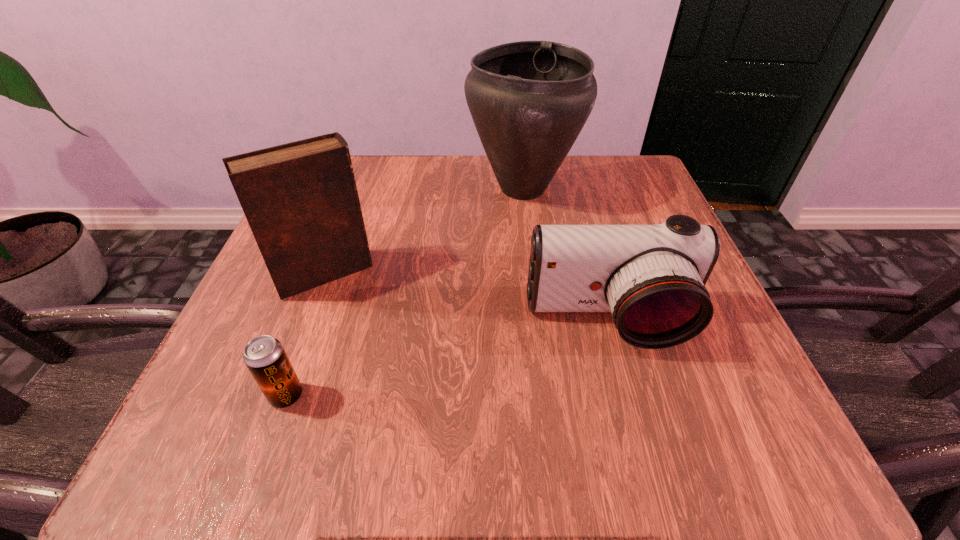
Find the location of a particular element. The width and height of the screenshot is (960, 540). free space at the near left corner is located at coordinates (173, 451).

Locate an element on the screen. vacant space at the near right corner of the desktop is located at coordinates (763, 441).

You are a GUI agent. You are given a task and a screenshot of the screen. Output one action in this format:
    pyautogui.click(x=<x>, y=<y>)
    Task: Click on the vacant point located between the nearest object and the farthest object
    The height and width of the screenshot is (540, 960).
    Given the screenshot: What is the action you would take?
    pyautogui.click(x=404, y=292)

You are a GUI agent. You are given a task and a screenshot of the screen. Output one action in this format:
    pyautogui.click(x=<x>, y=<y>)
    Task: Click on the vacant space that is in between the nearest object and the camcorder
    This screenshot has width=960, height=540.
    Given the screenshot: What is the action you would take?
    pyautogui.click(x=447, y=359)

I want to click on free space between the urn and the Bible, so click(x=423, y=231).

Find the location of a particular element. The height and width of the screenshot is (540, 960). free area in between the shortest object and the second tallest object is located at coordinates (305, 335).

Locate an element on the screen. Image resolution: width=960 pixels, height=540 pixels. empty space between the beer can and the farthest object is located at coordinates (404, 292).

Locate an element on the screen. vacant point located between the farthest object and the third shortest object is located at coordinates (423, 231).

Image resolution: width=960 pixels, height=540 pixels. I want to click on vacant space in between the Bible and the camcorder, so click(467, 298).

The height and width of the screenshot is (540, 960). In order to click on empty location between the third shortest object and the second shortest object in this screenshot , I will do `click(467, 298)`.